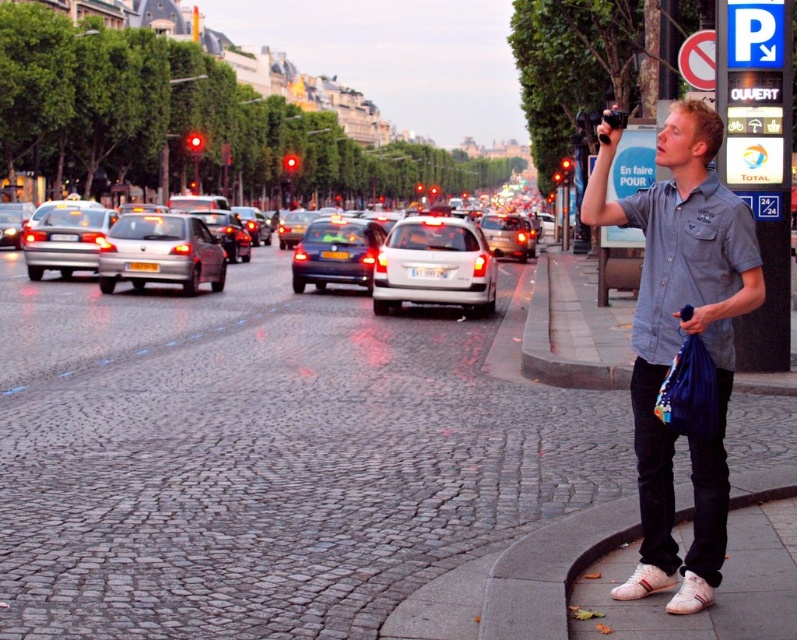
You are a delivery drone flying over an urban area. You need to land on the cobblestone pavement at center. What coordinates should you aim for?

The cobblestone pavement at center is located at coordinates (269, 454), so you should aim for those coordinates to land safely.

You are a pedestrian trying to cross the street at the intersection. You see a white matte hatchback at center and a matte silver sedan at center. Which vehicle is closer to the traffic light?

The white matte hatchback at center is positioned under the matte silver sedan at center, meaning it is closer to the traffic light.